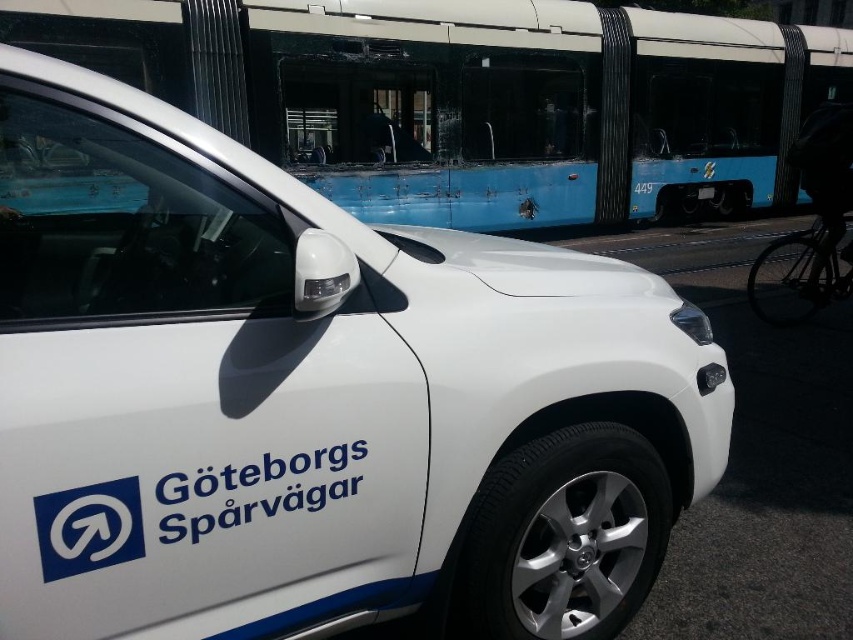
You are a delivery person needing to place a 10 feet long ladder between the blue matte bus at upper center and the shiny black bicycle at right. Can the ladder fit in the space between them?

The distance between the blue matte bus at upper center and the shiny black bicycle at right is 9.53 feet, so the ladder cannot fit as it is longer than the available space.

You are a delivery person trying to read the license plate of the black plastic license plate at center on the vehicle. However, there is a blue matte bus at upper center blocking your view. Can you move the bus to get a clear view of the license plate?

The blue matte bus at upper center is positioned over the black plastic license plate at center, so moving the bus would allow you to see the license plate clearly.

You are a delivery person trying to park your van between the blue matte bus at upper center and the shiny black bicycle at right. Can your van, which is 2 meters wide, fit in the space between them?

The blue matte bus at upper center is wider than the shiny black bicycle at right. However, the exact width of the space between them isn not provided in the description. Therefore, it is uncertain if the van can fit.